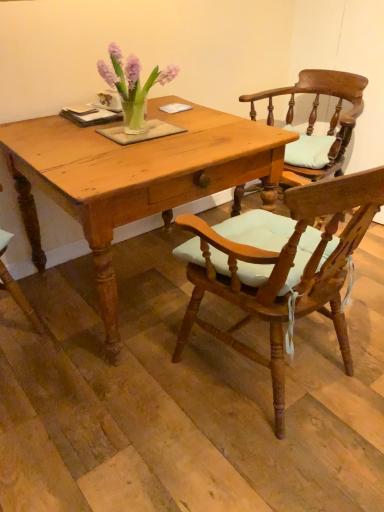
Question: Considering the relative positions of wooden chair with light blue cushion at center, which appears as the first chair when viewed from the front, and light brown wooden table at center in the image provided, is wooden chair with light blue cushion at center, which appears as the first chair when viewed from the front, to the right of light brown wooden table at center from the viewer's perspective?

Choices:
 (A) yes
 (B) no

Answer: (A)

Question: Considering the relative sizes of wooden chair with light blue cushion at center, which appears as the first chair when viewed from the front, and light brown wooden table at center in the image provided, is wooden chair with light blue cushion at center, which appears as the first chair when viewed from the front, wider than light brown wooden table at center?

Choices:
 (A) no
 (B) yes

Answer: (A)

Question: Is wooden chair with light blue cushion at center, which appears as the first chair when viewed from the front, positioned with its back to light brown wooden table at center?

Choices:
 (A) no
 (B) yes

Answer: (A)

Question: Is wooden chair with light blue cushion at center, which appears as the first chair when viewed from the front, located outside light brown wooden table at center?

Choices:
 (A) yes
 (B) no

Answer: (A)

Question: Does wooden chair with light blue cushion at center, which ranks as the second chair in back-to-front order, come behind light brown wooden table at center?

Choices:
 (A) yes
 (B) no

Answer: (B)

Question: From the image's perspective, is light brown wooden table at center above or below wooden chair with light blue cushion at center, which appears as the first chair when viewed from the front?

Choices:
 (A) below
 (B) above

Answer: (B)

Question: Is light brown wooden table at center inside the boundaries of wooden chair with light blue cushion at center, which appears as the first chair when viewed from the front, or outside?

Choices:
 (A) inside
 (B) outside

Answer: (B)

Question: Looking at their shapes, would you say light brown wooden table at center is wider or thinner than wooden chair with light blue cushion at center, which appears as the first chair when viewed from the front?

Choices:
 (A) wide
 (B) thin

Answer: (A)

Question: Is point (206, 135) closer or farther from the camera than point (246, 240)?

Choices:
 (A) closer
 (B) farther

Answer: (B)

Question: From a real-world perspective, is wooden chair with light blue cushion at center, which appears as the first chair when viewed from the front, positioned above or below light brown wooden table at center?

Choices:
 (A) below
 (B) above

Answer: (B)

Question: Does point (289, 295) appear closer or farther from the camera than point (107, 291)?

Choices:
 (A) farther
 (B) closer

Answer: (B)

Question: From the image's perspective, relative to light brown wooden table at center, is wooden chair with light blue cushion at center, which appears as the first chair when viewed from the front, above or below?

Choices:
 (A) above
 (B) below

Answer: (B)

Question: Considering the positions of wooden chair with light blue cushion at center, which ranks as the second chair in back-to-front order, and light brown wooden table at center in the image, is wooden chair with light blue cushion at center, which ranks as the second chair in back-to-front order, bigger or smaller than light brown wooden table at center?

Choices:
 (A) small
 (B) big

Answer: (A)

Question: Is wooden chair with cushion at center, placed as the 1th chair when sorted from back to front, inside the boundaries of light brown wooden table at center, or outside?

Choices:
 (A) outside
 (B) inside

Answer: (A)

Question: From a real-world perspective, is wooden chair with cushion at center, which is counted as the second chair, starting from the front, above or below light brown wooden table at center?

Choices:
 (A) above
 (B) below

Answer: (A)